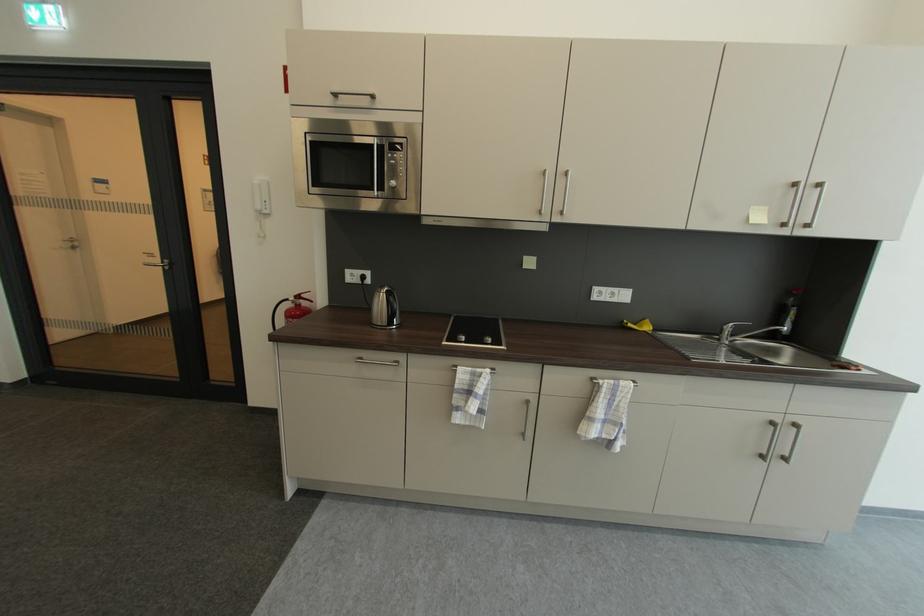
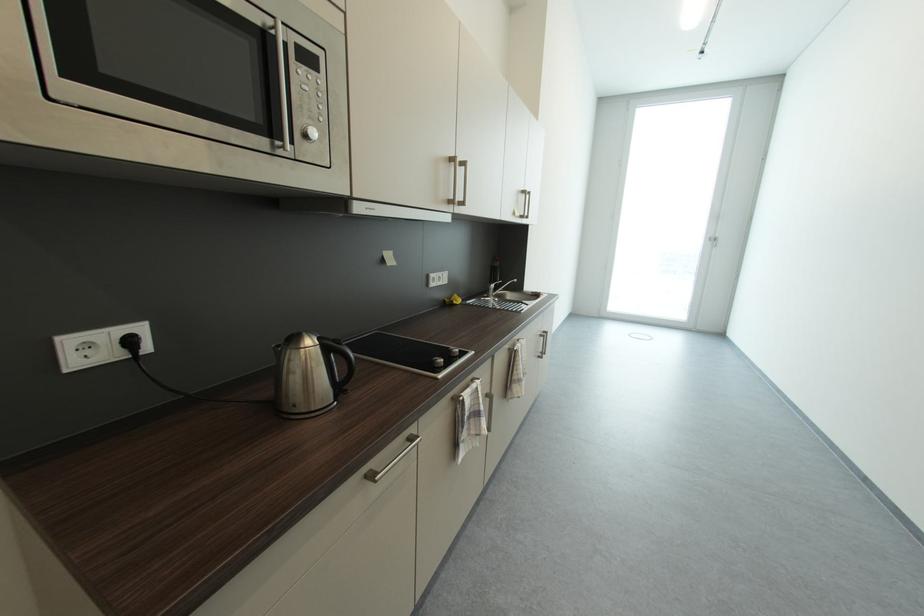
In the second image, find the point that corresponds to the point at 463,387 in the first image.

(472, 419)